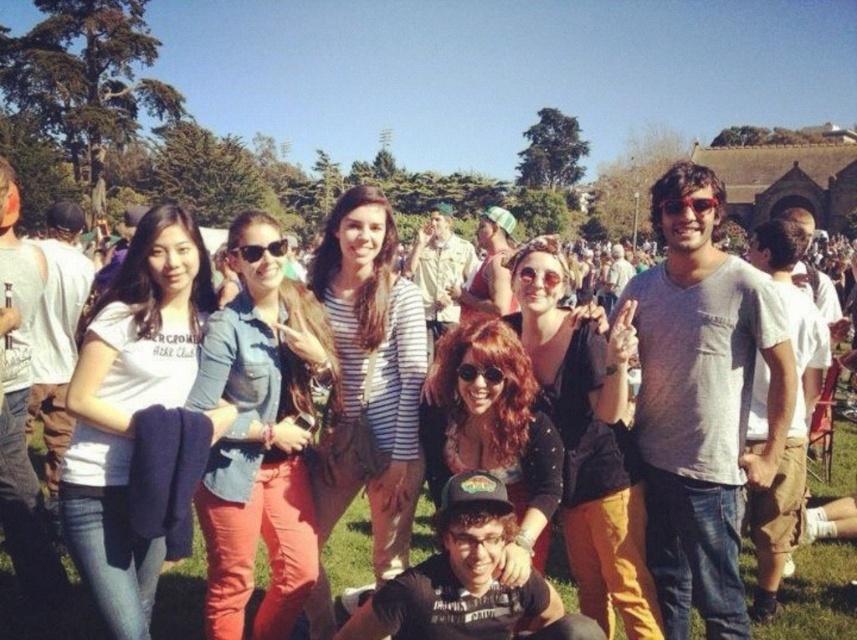
This screenshot has width=857, height=640. What are the coordinates of `matte black sunglasses at center` in the screenshot? It's located at (586, 438).

Who is higher up, matte black sunglasses at center or shiny red hair at center?

Positioned higher is matte black sunglasses at center.

The width and height of the screenshot is (857, 640). What do you see at coordinates (586, 438) in the screenshot? I see `matte black sunglasses at center` at bounding box center [586, 438].

Locate an element on the screen. The image size is (857, 640). matte black sunglasses at center is located at coordinates (586, 438).

Does point (280, 444) come farther from viewer compared to point (439, 342)?

No.

Is denim shirt at center positioned at the back of shiny red hair at center?

Yes, denim shirt at center is further from the viewer.

Who is more distant from viewer, (295, 388) or (550, 476)?

The point (295, 388) is more distant.

Locate an element on the screen. This screenshot has height=640, width=857. denim shirt at center is located at coordinates (259, 435).

Is point (123, 486) in front of point (318, 296)?

Yes, point (123, 486) is in front of point (318, 296).

Does white matte shirt at left appear on the right side of striped shirt at center?

In fact, white matte shirt at left is to the left of striped shirt at center.

Between point (118, 611) and point (396, 461), which one is positioned in front?

Point (118, 611) is more forward.

I want to click on white matte shirt at left, so click(130, 408).